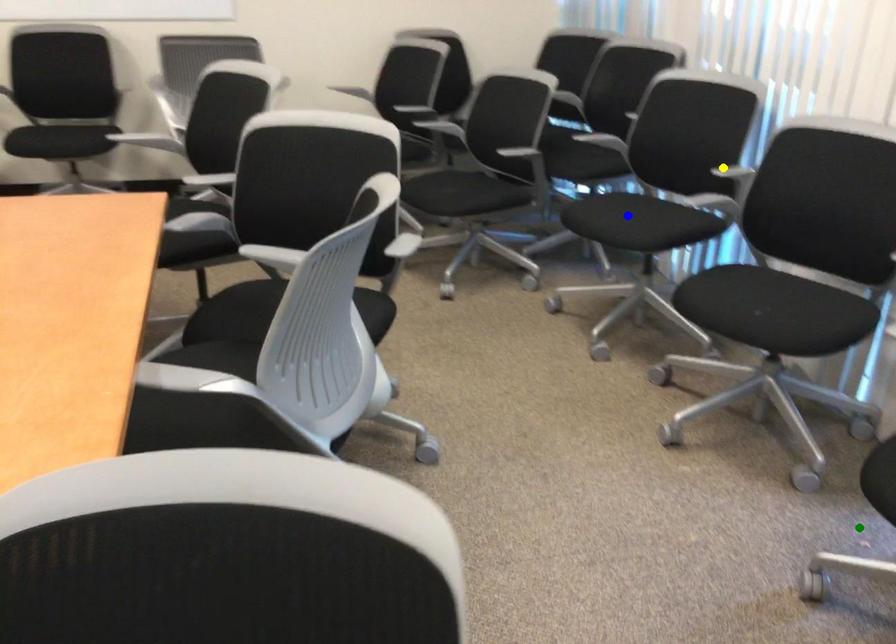
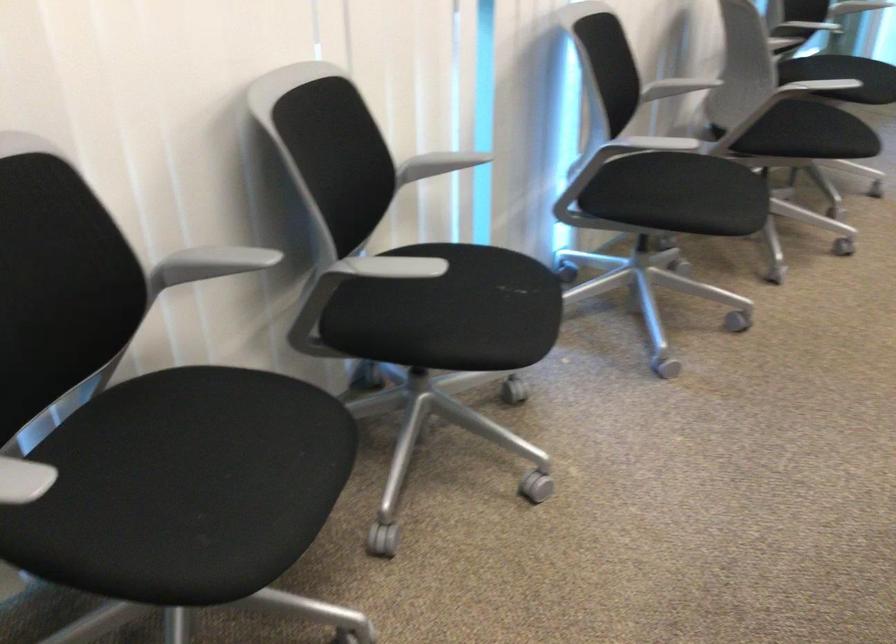
I am providing you with two images of the same scene from different viewpoints. Three points are marked in image1. Which point corresponds to a part or object that is occluded in image2?In image1, three points are marked. Which of them correspond to a part or object that is occluded in image2?Among the three points shown in image1, which one corresponds to a part or object that is no longer visible due to occlusion in image2?

green point cannot be seen in image2.